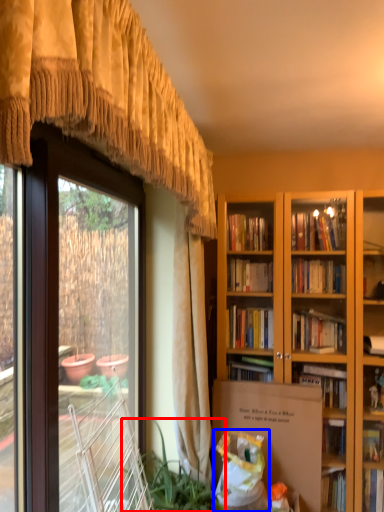
Question: Which object is further to the camera taking this photo, houseplant (highlighted by a red box) or shopping bag (highlighted by a blue box)?

Choices:
 (A) houseplant
 (B) shopping bag

Answer: (B)